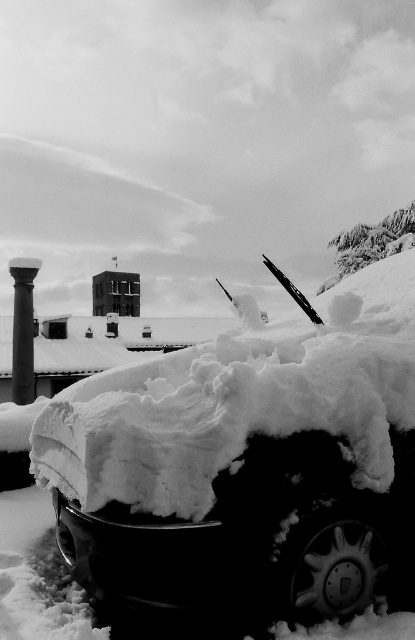
Question: Among these points, which one is farthest from the camera?

Choices:
 (A) (31, 264)
 (B) (78, 394)

Answer: (A)

Question: Is white fluffy snow at center below smooth black column at left?

Choices:
 (A) no
 (B) yes

Answer: (A)

Question: Can you confirm if white fluffy snow at center is positioned below smooth black column at left?

Choices:
 (A) yes
 (B) no

Answer: (B)

Question: Can you confirm if white fluffy snow at center is positioned below smooth black column at left?

Choices:
 (A) yes
 (B) no

Answer: (B)